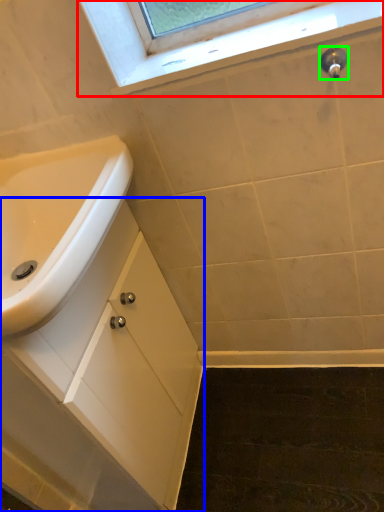
Question: Considering the real-world distances, which object is farthest from window (highlighted by a red box)? bathroom cabinet (highlighted by a blue box) or plumbing fixture (highlighted by a green box)?

Choices:
 (A) bathroom cabinet
 (B) plumbing fixture

Answer: (A)